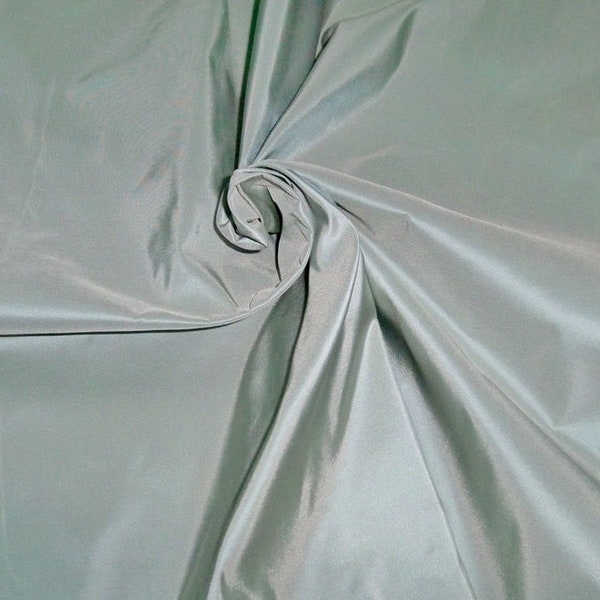
The width and height of the screenshot is (600, 600). What are the coordinates of `fabric` in the screenshot? It's located at pyautogui.click(x=129, y=437).